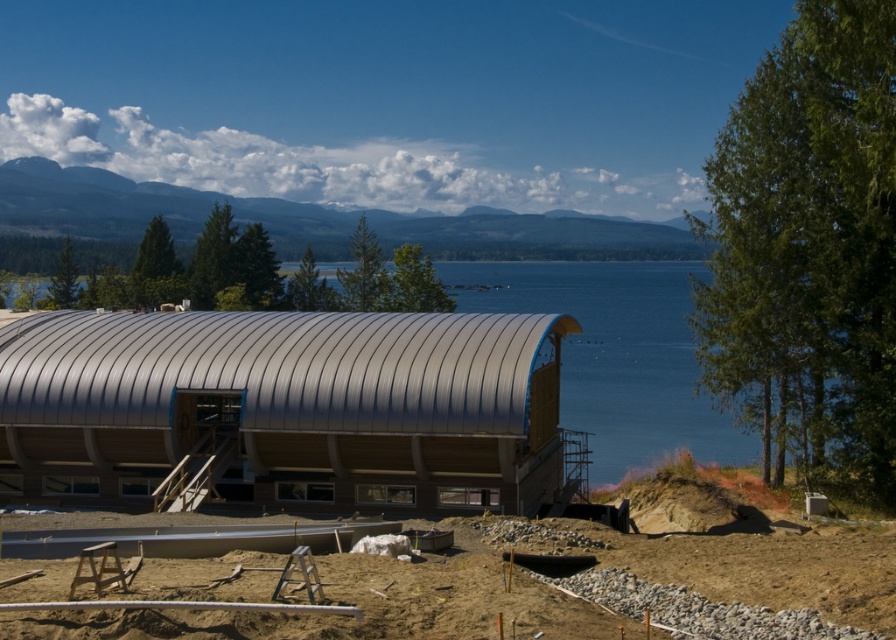
You are a construction worker standing at the sandy dirt at lower center. You need to reach the metallic silver hut at center to fetch a tool. Which direction should you move to get there?

The metallic silver hut at center is located above sandy dirt at lower center, so you should move upward to reach it.

You are a construction worker who needs to move a heavy tool from the sandy dirt at lower center to the metallic silver hut at center. Which direction should you move the tool to reach the hut?

The metallic silver hut at center is to the left of sandy dirt at lower center, so you should move the tool to the left to reach the hut.

You are a construction worker who needs to place a new tool on the ground. The tool requires a flat surface. Which object between the metallic silver hut at center and the sandy dirt at lower center would be suitable for placing the tool?

The sandy dirt at lower center is suitable for placing the tool as it is a flat surface, while the metallic silver hut at center is smaller and likely not a flat surface.